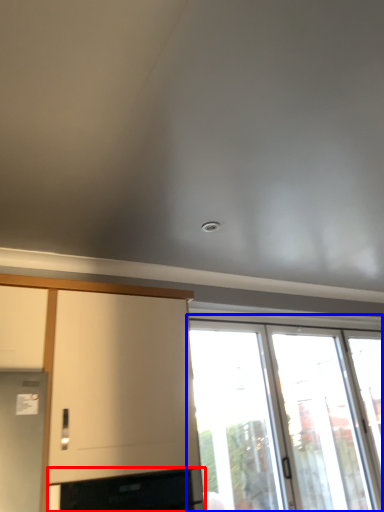
Question: Among these objects, which one is farthest to the camera, appliance (highlighted by a red box) or window (highlighted by a blue box)?

Choices:
 (A) appliance
 (B) window

Answer: (B)